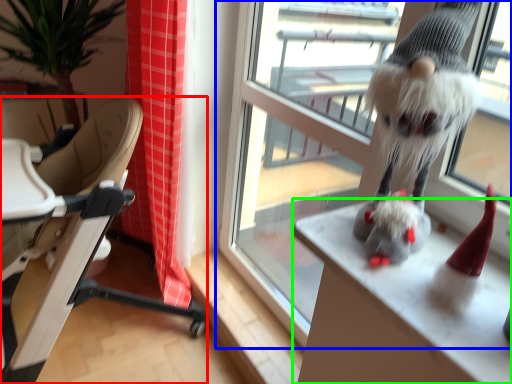
Question: Based on their relative distances, which object is farther from chair (highlighted by a red box)? Choose from window (highlighted by a blue box) and desk (highlighted by a green box).

Choices:
 (A) window
 (B) desk

Answer: (B)